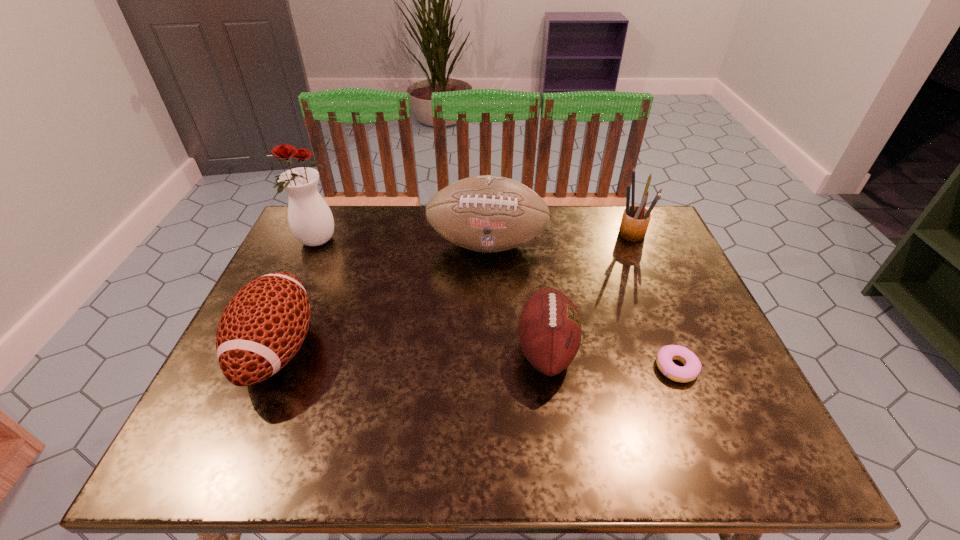
Identify the location of vacant space situated on the right of the second shortest object. The width and height of the screenshot is (960, 540). (723, 349).

Identify the location of vacant space located 0.260m on the left of the shortest object. (539, 368).

Find the location of `vase at the far edge`. vase at the far edge is located at coordinates (310, 219).

The width and height of the screenshot is (960, 540). I want to click on football (American) at the far edge, so click(x=488, y=213).

You are a GUI agent. You are given a task and a screenshot of the screen. Output one action in this format:
    pyautogui.click(x=<x>, y=<y>)
    Task: Click on the pencil box positioned at the far edge
    
    Given the screenshot: What is the action you would take?
    pyautogui.click(x=635, y=220)

This screenshot has width=960, height=540. Identify the location of vase situated at the left edge. point(310,219).

Identify the location of football that is at the left edge. This screenshot has width=960, height=540. (263, 326).

Identify the location of pencil box located in the right edge section of the desktop. This screenshot has width=960, height=540. (635, 220).

The image size is (960, 540). Identify the location of doughnut that is positioned at the right edge. (692, 366).

Identify the location of object situated at the far left corner. (310, 219).